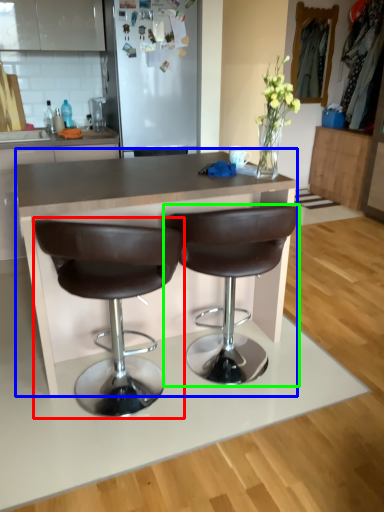
Question: Which object is positioned farthest from chair (highlighted by a red box)? Select from table (highlighted by a blue box) and chair (highlighted by a green box).

Choices:
 (A) table
 (B) chair

Answer: (B)